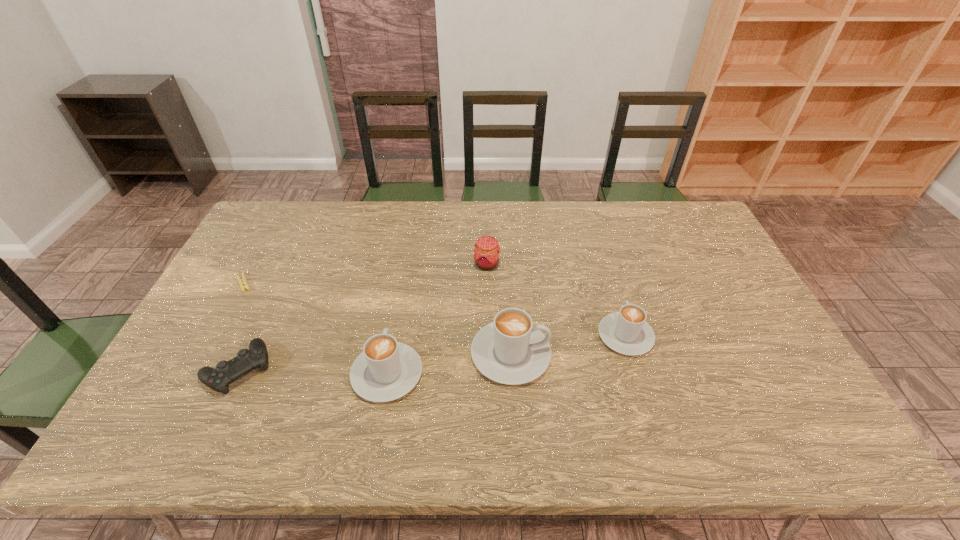
Identify the location of control positioned at the left edge. (246, 361).

Where is `object that is at the near left corner`? object that is at the near left corner is located at coordinates (246, 361).

I want to click on vacant space at the far edge of the desktop, so click(300, 241).

The height and width of the screenshot is (540, 960). I want to click on vacant space at the near edge of the desktop, so click(584, 377).

This screenshot has height=540, width=960. Identify the location of blank space at the left edge. (212, 325).

You are a GUI agent. You are given a task and a screenshot of the screen. Output one action in this format:
    pyautogui.click(x=<x>, y=<y>)
    Task: Click on the vacant space at the right edge of the desktop
    
    Given the screenshot: What is the action you would take?
    (737, 295)

You are a GUI agent. You are given a task and a screenshot of the screen. Output one action in this format:
    pyautogui.click(x=<x>, y=<y>)
    Task: Click on the vacant space at the near right corner of the desktop
    The width and height of the screenshot is (960, 540).
    Given the screenshot: What is the action you would take?
    pyautogui.click(x=743, y=395)

This screenshot has height=540, width=960. Find the location of `unoccupied position between the shortest object and the second tallest cappuccino`. unoccupied position between the shortest object and the second tallest cappuccino is located at coordinates [x=315, y=328].

Locate an element on the screen. vacant area that lies between the shortest object and the rightmost cappuccino is located at coordinates [434, 309].

At what (x,y) coordinates should I click in order to perform the action: click on free spot between the second shortest cappuccino and the second cappuccino from right to left. Please return your answer as a coordinate pair (x, y). This screenshot has width=960, height=540. Looking at the image, I should click on (449, 364).